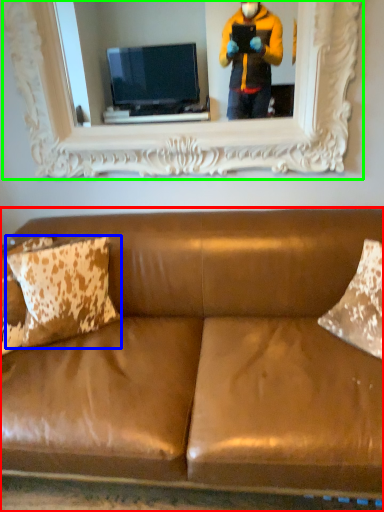
Question: Which is farther away from studio couch (highlighted by a red box)? pillow (highlighted by a blue box) or picture frame (highlighted by a green box)?

Choices:
 (A) pillow
 (B) picture frame

Answer: (B)